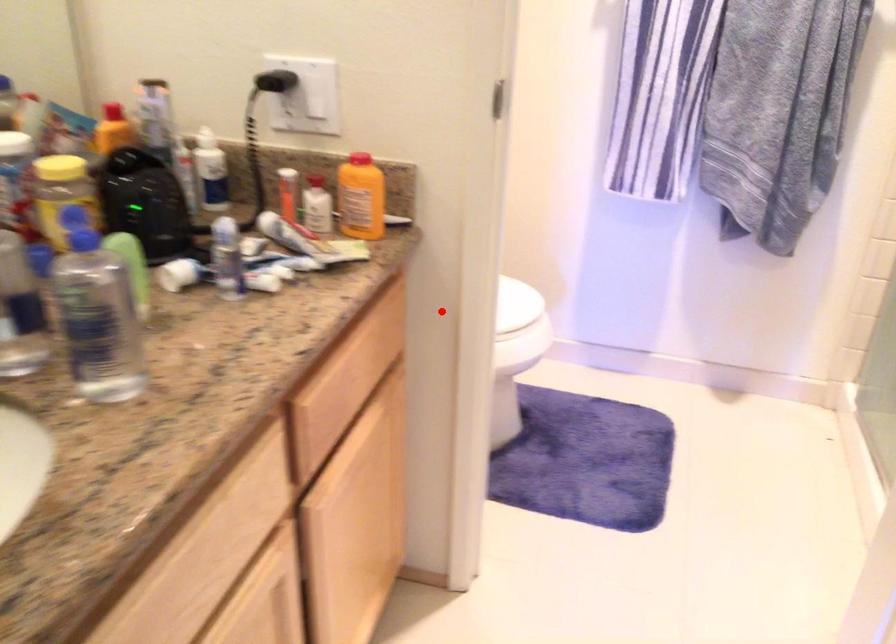
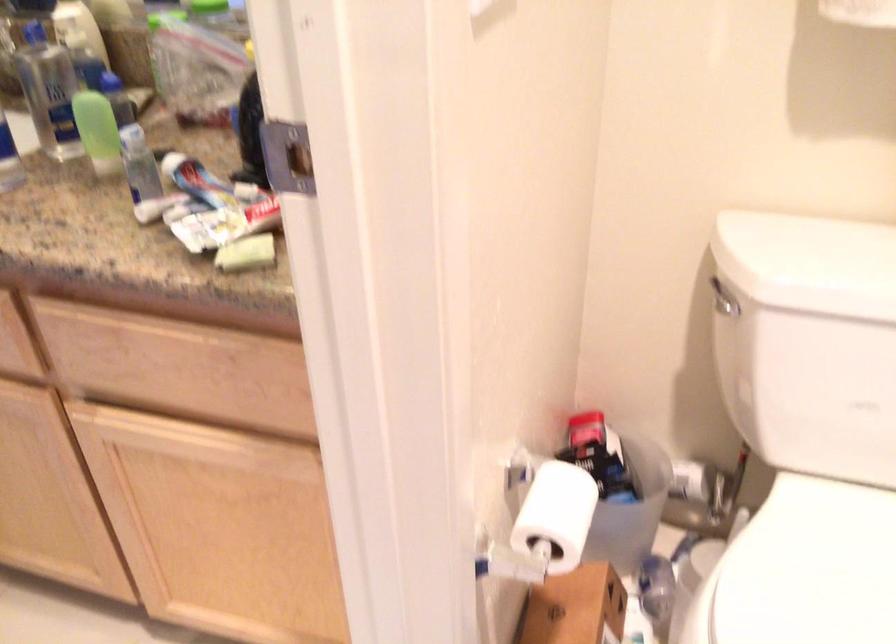
Locate, in the second image, the point that corresponds to the highlighted location in the first image.

(556, 515)